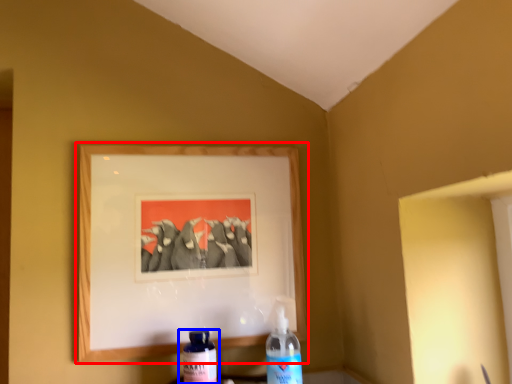
Question: Which object appears farthest to the camera in this image, picture frame (highlighted by a red box) or bottle (highlighted by a blue box)?

Choices:
 (A) picture frame
 (B) bottle

Answer: (A)